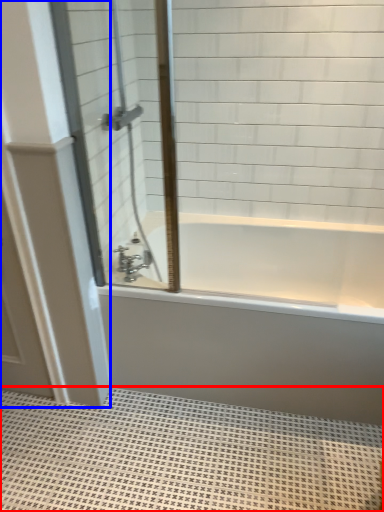
Question: Which point is further to the camera, bath mat (highlighted by a red box) or door (highlighted by a blue box)?

Choices:
 (A) bath mat
 (B) door

Answer: (B)